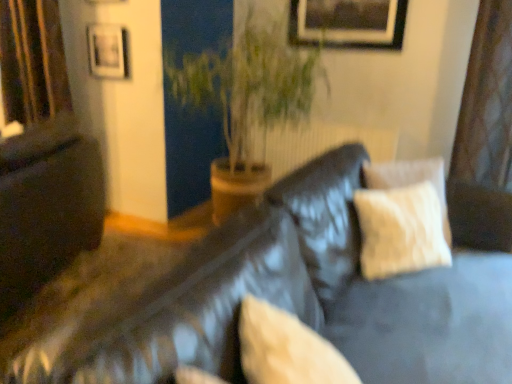
Question: Is matte black couch at left to the right of green leafy plant at center from the viewer's perspective?

Choices:
 (A) yes
 (B) no

Answer: (B)

Question: Is matte black couch at left not close to green leafy plant at center?

Choices:
 (A) yes
 (B) no

Answer: (B)

Question: From the image's perspective, is matte black couch at left on green leafy plant at center?

Choices:
 (A) yes
 (B) no

Answer: (B)

Question: Can you confirm if matte black couch at left is bigger than green leafy plant at center?

Choices:
 (A) no
 (B) yes

Answer: (A)

Question: From a real-world perspective, is matte black couch at left positioned under green leafy plant at center based on gravity?

Choices:
 (A) no
 (B) yes

Answer: (B)

Question: Is matte black couch at left oriented towards green leafy plant at center?

Choices:
 (A) no
 (B) yes

Answer: (A)

Question: Considering the relative sizes of matte black couch at left and matte black picture frame at upper left, which is the first picture frame in left-to-right order, in the image provided, is matte black couch at left shorter than matte black picture frame at upper left, which is the first picture frame in left-to-right order,?

Choices:
 (A) no
 (B) yes

Answer: (A)

Question: Is matte black couch at left bigger than matte black picture frame at upper left, arranged as the 2th picture frame when viewed from the right?

Choices:
 (A) yes
 (B) no

Answer: (A)

Question: Would you consider matte black couch at left to be distant from matte black picture frame at upper left, which is the first picture frame in left-to-right order?

Choices:
 (A) yes
 (B) no

Answer: (B)

Question: Is matte black couch at left turned away from matte black picture frame at upper left, which is the first picture frame in left-to-right order?

Choices:
 (A) yes
 (B) no

Answer: (B)

Question: Does matte black couch at left have a smaller size compared to matte black picture frame at upper left, which is the first picture frame in left-to-right order?

Choices:
 (A) no
 (B) yes

Answer: (A)

Question: Does matte black couch at left have a greater height compared to matte black picture frame at upper left, which is the first picture frame in left-to-right order?

Choices:
 (A) no
 (B) yes

Answer: (B)

Question: Does green leafy plant at center turn towards matte black couch at left?

Choices:
 (A) no
 (B) yes

Answer: (A)